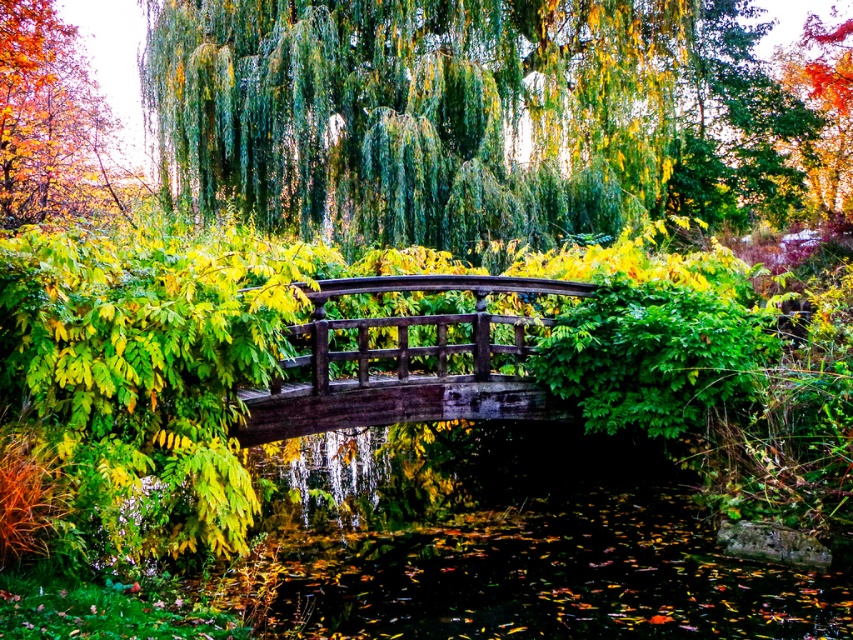
Question: Which point appears farthest from the camera in this image?

Choices:
 (A) (334, 285)
 (B) (250, 209)

Answer: (B)

Question: Which point is closer to the camera?

Choices:
 (A) (3, 147)
 (B) (387, 138)
 (C) (399, 420)

Answer: (C)

Question: Does wooden bridge at center appear on the right side of autumn leaves at upper left?

Choices:
 (A) no
 (B) yes

Answer: (B)

Question: In this image, where is green leafy tree at center located relative to wooden bridge at center?

Choices:
 (A) above
 (B) below

Answer: (A)

Question: Can you confirm if wooden bridge at center is positioned below autumn leaves at upper left?

Choices:
 (A) yes
 (B) no

Answer: (A)

Question: Which point is farther from the camera taking this photo?

Choices:
 (A) (325, 364)
 (B) (10, 92)
 (C) (309, 48)

Answer: (B)